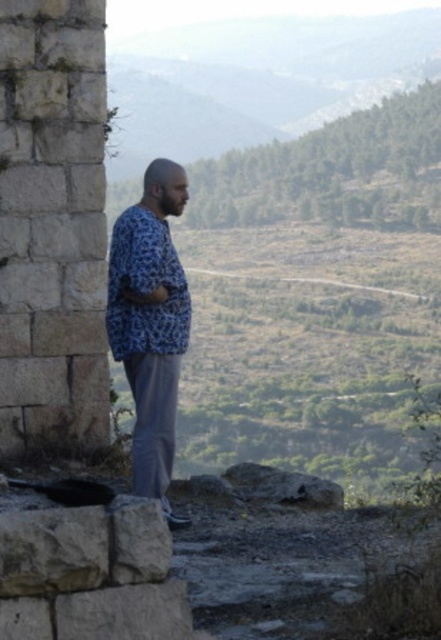
Where is `white stone wall at left`? white stone wall at left is located at coordinates (52, 225).

Between point (85, 44) and point (153, 237), which one is positioned in front?

Point (153, 237) is more forward.

Find the location of a particular element. white stone wall at left is located at coordinates (52, 225).